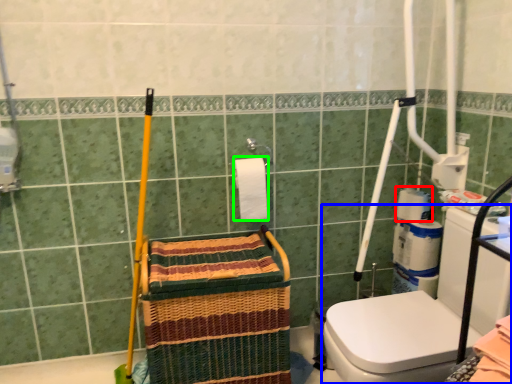
Question: Considering the real-world distances, which object is closest to toilet paper (highlighted by a red box)? washer (highlighted by a blue box) or toilet paper (highlighted by a green box).

Choices:
 (A) washer
 (B) toilet paper

Answer: (A)